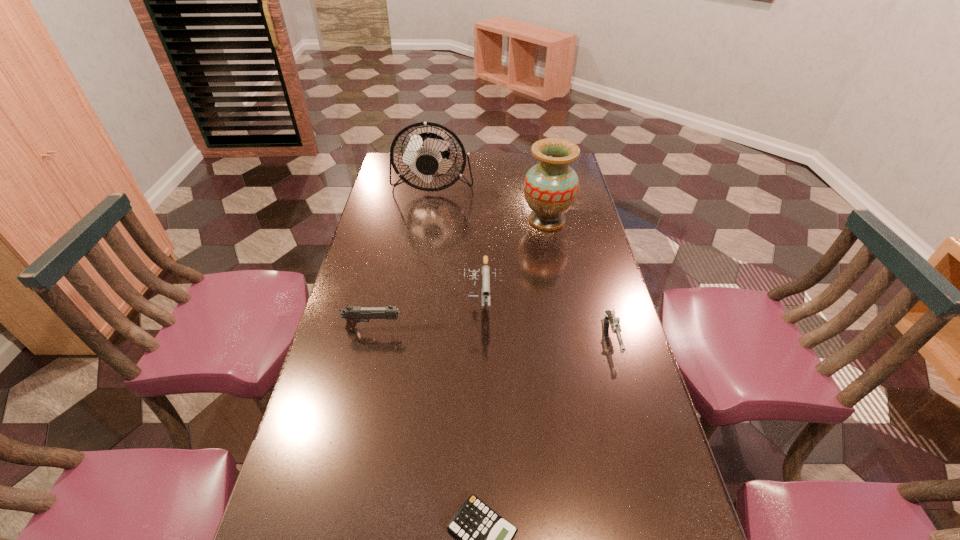
The image size is (960, 540). Find the location of `free spot between the second object from right to left and the second tallest gun`. free spot between the second object from right to left and the second tallest gun is located at coordinates (460, 276).

Where is `blank region between the tallest gun and the fourth tallest object`? This screenshot has height=540, width=960. blank region between the tallest gun and the fourth tallest object is located at coordinates (427, 316).

Locate which object is the closest to the rightmost gun. Please provide its 2D coordinates. Your answer should be formatted as a tuple, i.e. [(x, y)], where the tuple contains the x and y coordinates of a point satisfying the conditions above.

[(485, 268)]

Identify which object is located as the third nearest to the rightmost gun. Please provide its 2D coordinates. Your answer should be formatted as a tuple, i.e. [(x, y)], where the tuple contains the x and y coordinates of a point satisfying the conditions above.

[(485, 539)]

Locate which gun is the closest to the shortest gun. Please provide its 2D coordinates. Your answer should be formatted as a tuple, i.e. [(x, y)], where the tuple contains the x and y coordinates of a point satisfying the conditions above.

[(485, 268)]

You are a GUI agent. You are given a task and a screenshot of the screen. Output one action in this format:
    pyautogui.click(x=<x>, y=<y>)
    Task: Click on the second closest gun to the shortest object
    The height and width of the screenshot is (540, 960).
    Given the screenshot: What is the action you would take?
    pyautogui.click(x=485, y=268)

I want to click on blank space that satisfies the following two spatial constraints: 1. in front of the fan, directing airflow; 2. in the direction the second tallest gun is aimed, so click(x=411, y=330).

At what (x,y) coordinates should I click in order to perform the action: click on vacant space that satisfies the following two spatial constraints: 1. in front of the fan, directing airflow; 2. in the direction the fourth tallest object is aimed. Please return your answer as a coordinate pair (x, y). Looking at the image, I should click on (411, 330).

Image resolution: width=960 pixels, height=540 pixels. Identify the location of free spot that satisfies the following two spatial constraints: 1. in front of the farthest object, directing airflow; 2. in the direction the third shortest object is aimed. (411, 330).